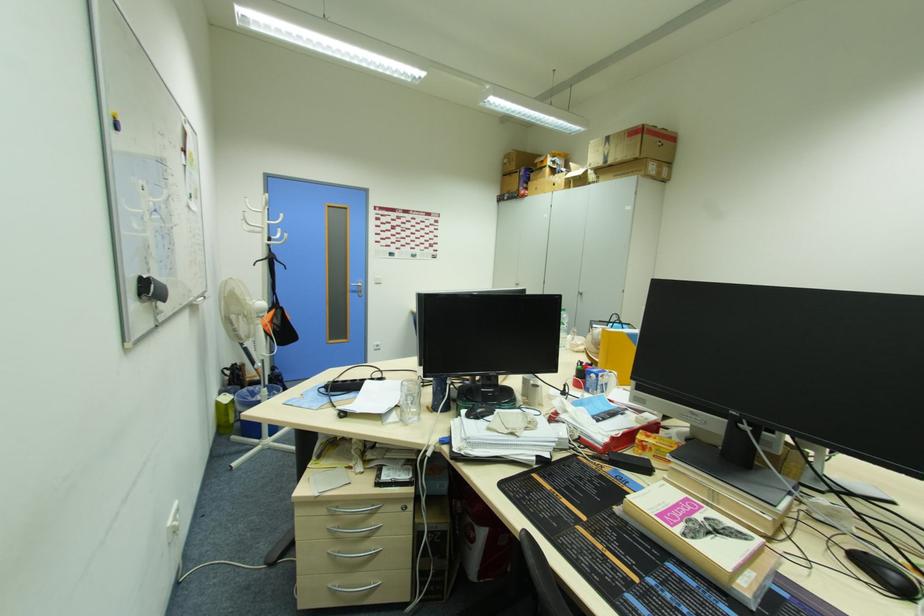
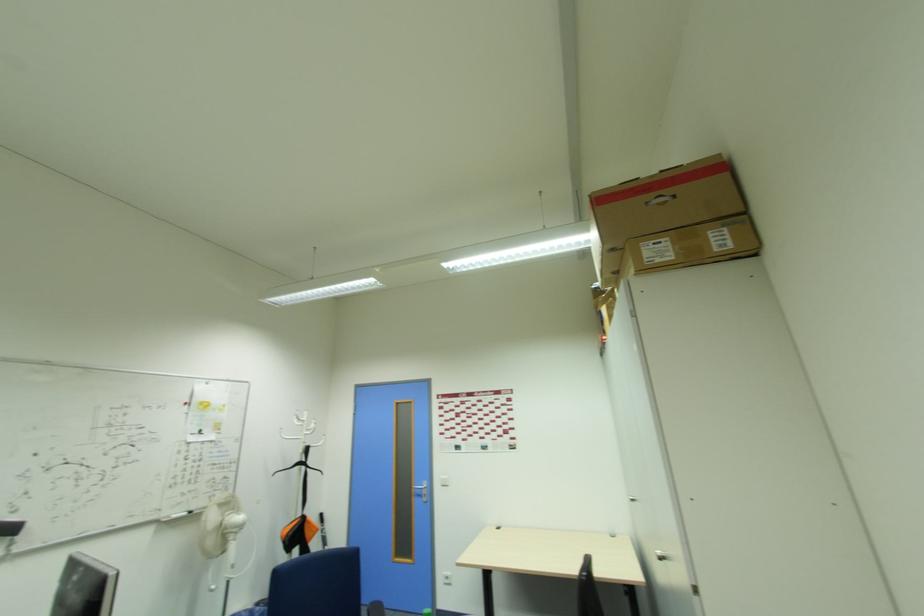
Question: I am providing you with two images of the same scene from different viewpoints. After the viewpoint changes to image2, which objects are now occluded?

Choices:
 (A) silver door handle
 (B) small cabinet knob
 (C) brown cardboard box
 (D) none of these

Answer: (D)